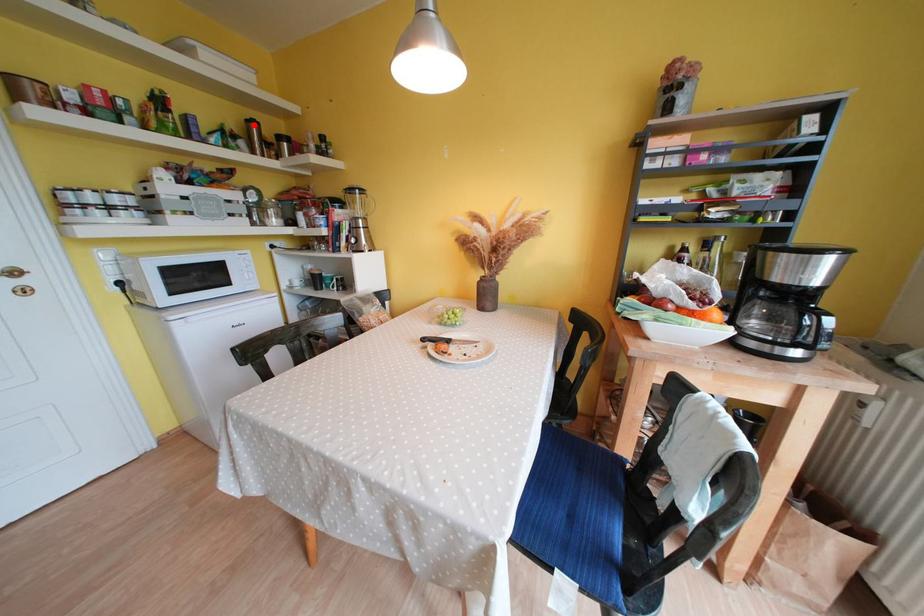
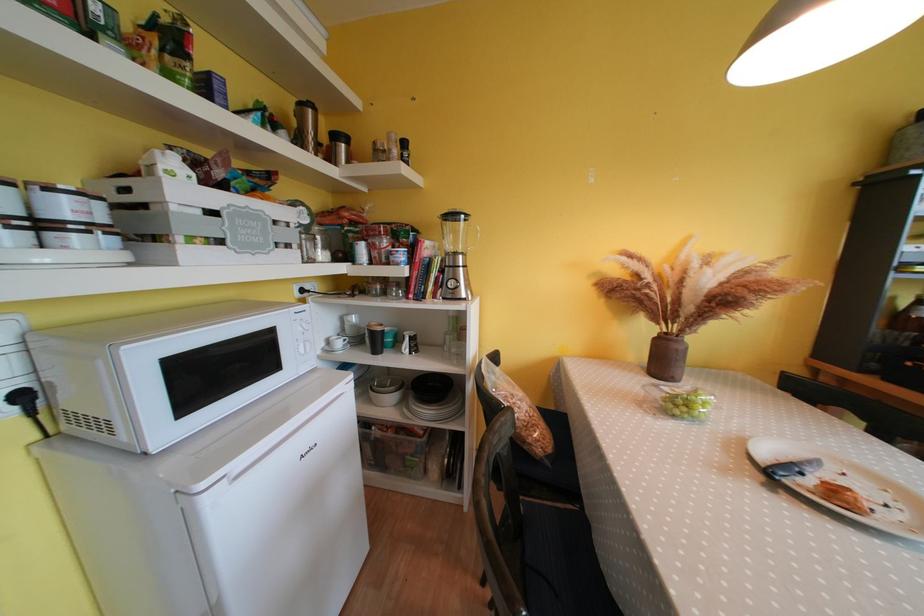
The point at the highlighted location is marked in the first image. Where is the corresponding point in the second image?

(308, 108)